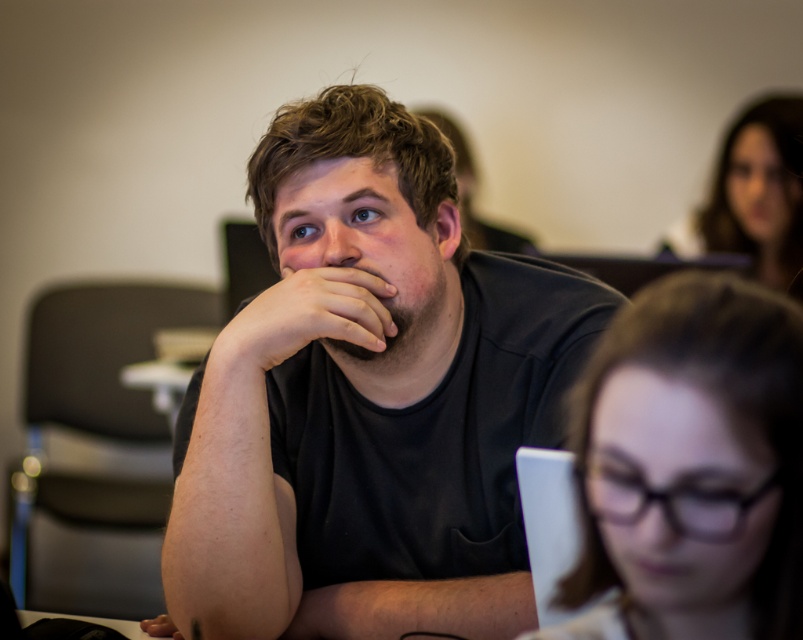
In the scene shown: Can you confirm if black matte shirt at center is taller than smooth brown hair at upper right?

Indeed, black matte shirt at center has a greater height compared to smooth brown hair at upper right.

Describe the element at coordinates (369, 397) in the screenshot. This screenshot has height=640, width=803. I see `black matte shirt at center` at that location.

Between point (308, 556) and point (773, 269), which one is positioned behind?

Positioned behind is point (773, 269).

I want to click on black matte shirt at center, so click(369, 397).

Who is taller, clear plastic glasses at center or smooth brown hair at upper right?

smooth brown hair at upper right

Does clear plastic glasses at center have a larger size compared to smooth brown hair at upper right?

No, clear plastic glasses at center is not bigger than smooth brown hair at upper right.

Between point (752, 308) and point (749, 204), which one is positioned behind?

Positioned behind is point (749, 204).

Find the location of a particular element. The image size is (803, 640). clear plastic glasses at center is located at coordinates (691, 465).

Does black matte shirt at center have a smaller size compared to matte black hand at center?

No.

Can you confirm if black matte shirt at center is wider than matte black hand at center?

Indeed, black matte shirt at center has a greater width compared to matte black hand at center.

Is point (336, 308) positioned after point (300, 330)?

Yes, it is behind point (300, 330).

You are a GUI agent. You are given a task and a screenshot of the screen. Output one action in this format:
    pyautogui.click(x=<x>, y=<y>)
    Task: Click on the black matte shirt at center
    
    Given the screenshot: What is the action you would take?
    pyautogui.click(x=369, y=397)